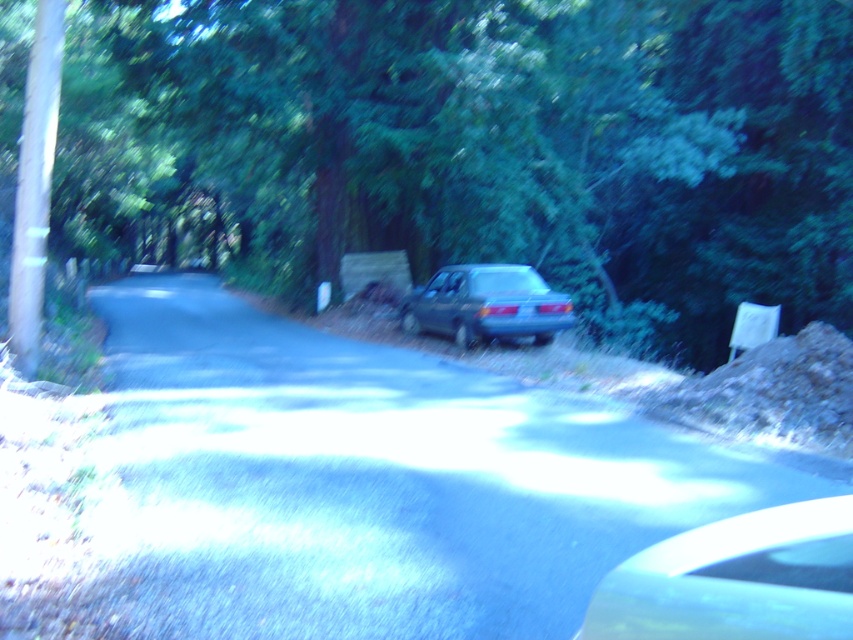
In the scene shown: Which of these two, glossy metallic car at center or satin blue sedan at center, stands shorter?

glossy metallic car at center is shorter.

Can you confirm if glossy metallic car at center is positioned above satin blue sedan at center?

Actually, glossy metallic car at center is below satin blue sedan at center.

This screenshot has width=853, height=640. Identify the location of glossy metallic car at center. pyautogui.click(x=735, y=579).

You are a GUI agent. You are given a task and a screenshot of the screen. Output one action in this format:
    pyautogui.click(x=<x>, y=<y>)
    Task: Click on the glossy metallic car at center
    This screenshot has width=853, height=640.
    Given the screenshot: What is the action you would take?
    pyautogui.click(x=735, y=579)

Where is `green leafy tree at center`? The image size is (853, 640). green leafy tree at center is located at coordinates (473, 148).

Which is below, green leafy tree at center or satin blue sedan at center?

Positioned lower is satin blue sedan at center.

What do you see at coordinates (473, 148) in the screenshot? The image size is (853, 640). I see `green leafy tree at center` at bounding box center [473, 148].

Where is `green leafy tree at center`? The width and height of the screenshot is (853, 640). green leafy tree at center is located at coordinates (473, 148).

Measure the distance between green leafy tree at center and camera.

A distance of 42.71 feet exists between green leafy tree at center and camera.

Can you confirm if green leafy tree at center is bigger than glossy metallic car at center?

Yes, green leafy tree at center is bigger than glossy metallic car at center.

Is point (664, 216) positioned behind point (711, 557)?

That is True.

Identify the location of green leafy tree at center. (473, 148).